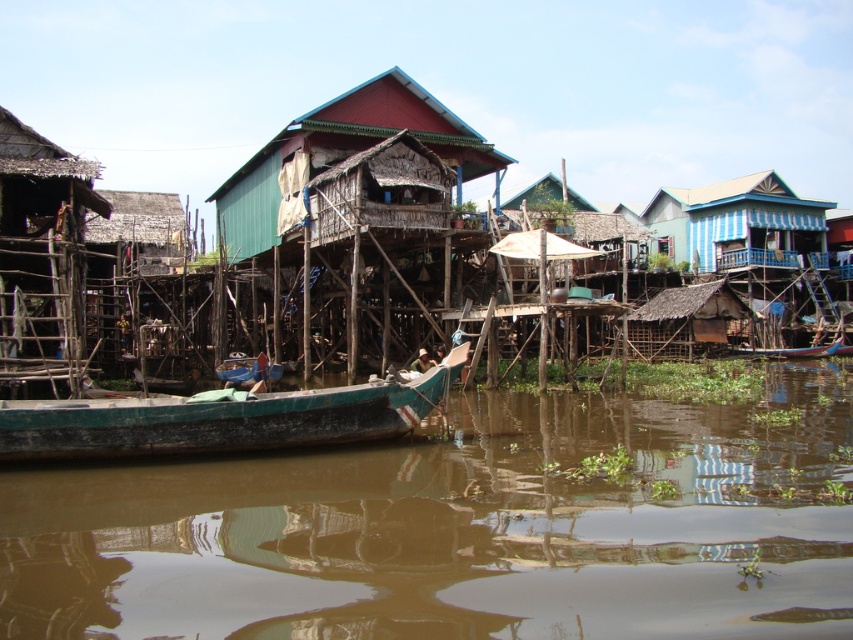
Question: Is brown murky water at center to the right of wooden boat at center from the viewer's perspective?

Choices:
 (A) no
 (B) yes

Answer: (A)

Question: Which point is closer to the camera?

Choices:
 (A) (347, 227)
 (B) (753, 353)
 (C) (380, 486)

Answer: (C)

Question: Can you confirm if brown murky water at center is wider than thatched bamboo hut at left?

Choices:
 (A) no
 (B) yes

Answer: (B)

Question: Which of these objects is positioned closest to the thatched bamboo hut at left?

Choices:
 (A) brown murky water at center
 (B) wooden thatched hut at center

Answer: (B)

Question: Is the position of wooden stilt houses at center more distant than that of wooden thatched hut at center?

Choices:
 (A) no
 (B) yes

Answer: (A)

Question: Which of the following is the closest to the observer?

Choices:
 (A) (828, 353)
 (B) (91, 211)
 (C) (390, 582)

Answer: (C)